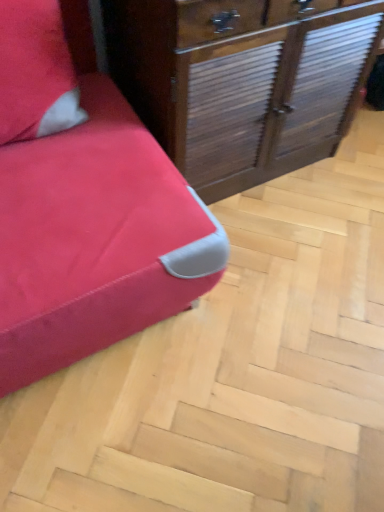
The height and width of the screenshot is (512, 384). What are the coordinates of `unoccupied region to the right of matte red sofa at left` in the screenshot? It's located at (288, 310).